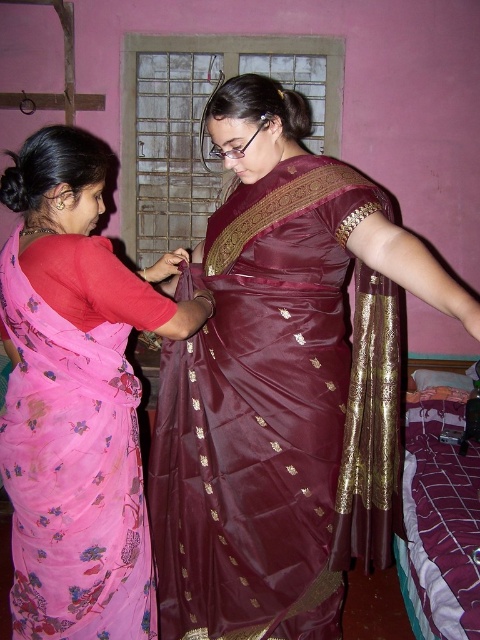
Between maroon satin saree at center and floral chiffon sari at left, which one appears on the left side from the viewer's perspective?

floral chiffon sari at left is more to the left.

The height and width of the screenshot is (640, 480). I want to click on maroon satin saree at center, so click(x=284, y=385).

From the picture: Is maroon satin saree at center thinner than gold silk saree at center?

No, maroon satin saree at center is not thinner than gold silk saree at center.

Is maroon satin saree at center positioned at the back of gold silk saree at center?

No, it is not.

This screenshot has width=480, height=640. Identify the location of maroon satin saree at center. (x=284, y=385).

I want to click on maroon satin saree at center, so click(284, 385).

Where is `floral chiffon sari at left`? floral chiffon sari at left is located at coordinates 72,474.

Between point (143, 589) and point (463, 396), which one is positioned in front?

Point (143, 589) is more forward.

At what (x,y) coordinates should I click in order to perform the action: click on floral chiffon sari at left. Please return your answer as a coordinate pair (x, y). This screenshot has height=640, width=480. Looking at the image, I should click on (72, 474).